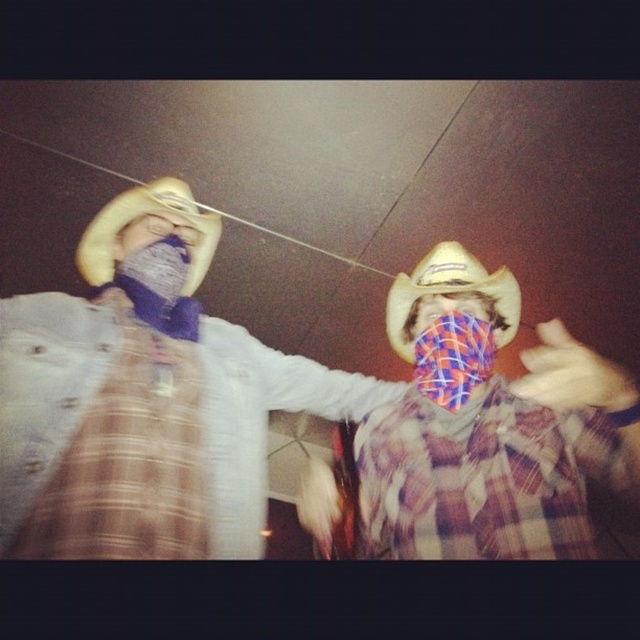
You are standing in front of the scene with two cowboys. There are two points marked in the image. Which point, point (125, 195) or point (397, 330), is closer to you?

Point (125, 195) is closer to the viewer than point (397, 330).

You are a photographer at a rodeo event. You need to capture a photo of the light brown leather cowboy hat at left and the light brown felt cowboy hat at center. Which hat should you focus on to ensure it fits entirely within your camera frame if your frame can only accommodate the smaller of the two hats?

You should focus on the light brown leather cowboy hat at left because it is smaller than the light brown felt cowboy hat at center, ensuring it fits within the camera frame.

You are an AI analyzing the positions of objects in the image. The coordinate system has the origin at the bottom left corner of the image. The light brown leather cowboy hat at left is located at which coordinate?

The light brown leather cowboy hat at left is located at coordinate point (141, 216).